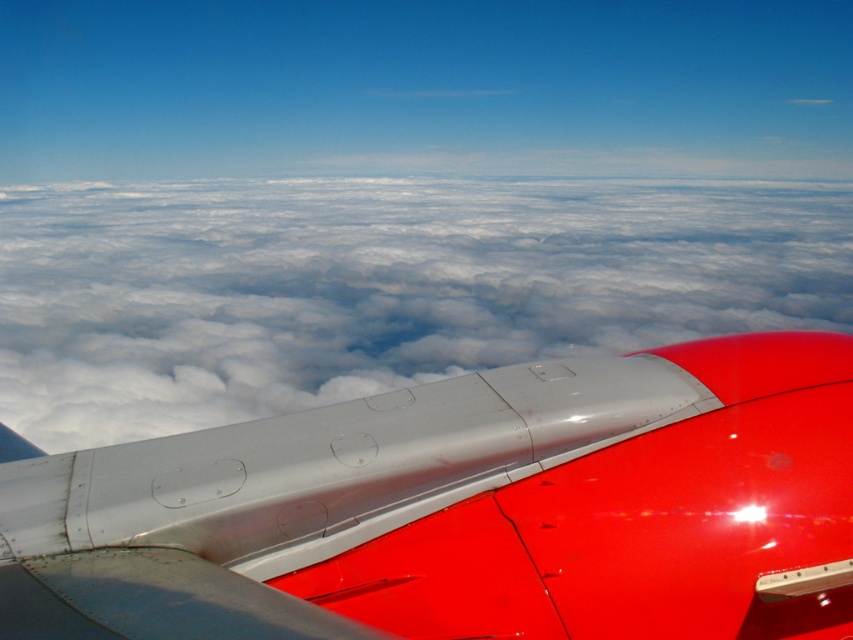
Question: Does metallic silver winglet at upper right have a lesser width compared to cloudy white at upper center?

Choices:
 (A) yes
 (B) no

Answer: (A)

Question: Is metallic silver winglet at upper right further to the viewer compared to cloudy white at upper center?

Choices:
 (A) no
 (B) yes

Answer: (A)

Question: Which object is farther from the camera taking this photo?

Choices:
 (A) metallic silver winglet at upper right
 (B) cloudy white at upper center

Answer: (B)

Question: Which point is closer to the camera?

Choices:
 (A) [x=646, y=253]
 (B) [x=405, y=396]

Answer: (B)

Question: Which of the following is the farthest from the observer?

Choices:
 (A) (807, 346)
 (B) (554, 179)

Answer: (B)

Question: Is metallic silver winglet at upper right bigger than cloudy white at upper center?

Choices:
 (A) yes
 (B) no

Answer: (B)